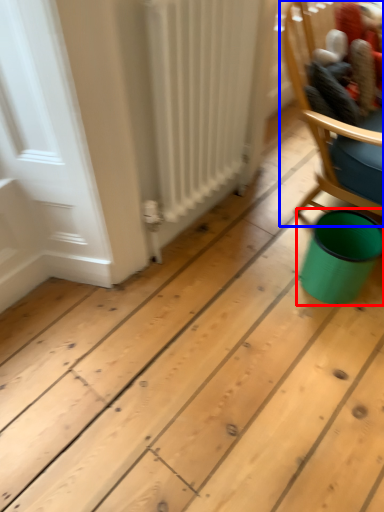
Question: Among these objects, which one is nearest to the camera, teal (highlighted by a red box) or chair (highlighted by a blue box)?

Choices:
 (A) teal
 (B) chair

Answer: (B)